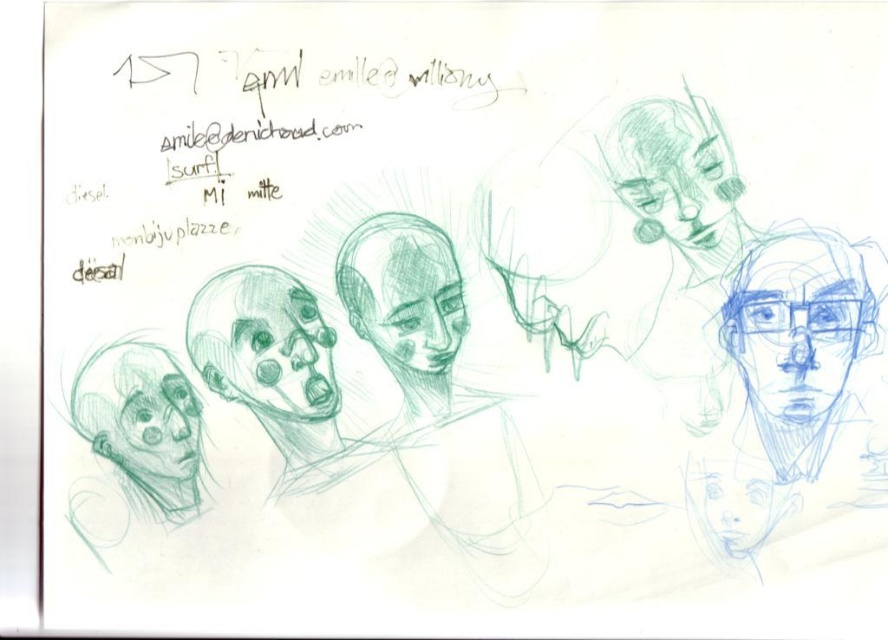
Question: Which of the following is the closest to the observer?

Choices:
 (A) (607, 161)
 (B) (400, 285)

Answer: (A)

Question: Which of the following is the farthest from the observer?

Choices:
 (A) (801, 410)
 (B) (657, 144)
 (C) (351, 300)
 (D) (147, 438)

Answer: (C)

Question: Does blue pencil sketch at upper right have a greater width compared to green pencil sketch of face at center?

Choices:
 (A) yes
 (B) no

Answer: (A)

Question: Does gray pencil sketch of skull at center have a lesser width compared to green pencil sketch face at upper right?

Choices:
 (A) yes
 (B) no

Answer: (B)

Question: Does gray pencil sketch of skull at center appear over graphite sketch face at lower left?

Choices:
 (A) yes
 (B) no

Answer: (A)

Question: Which object appears closest to the camera in this image?

Choices:
 (A) gray pencil sketch of skull at center
 (B) green pencil sketch of face at center
 (C) green pencil sketch face at upper right
 (D) blue pencil sketch at upper right

Answer: (D)